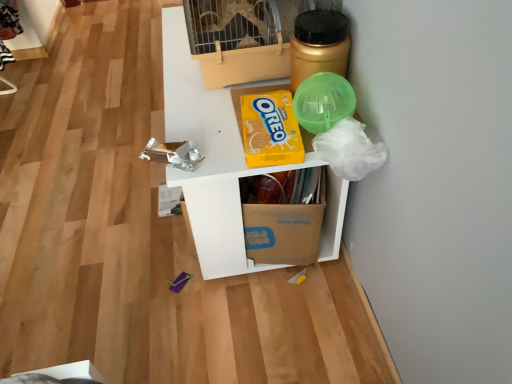
The width and height of the screenshot is (512, 384). Find the location of `free space in front of brown cardboard box at center`. free space in front of brown cardboard box at center is located at coordinates (279, 321).